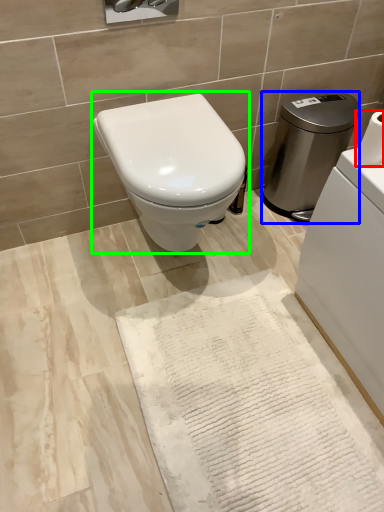
Question: Estimate the real-world distances between objects in this image. Which object is closer to toilet paper (highlighted by a red box), water heater (highlighted by a blue box) or toilet (highlighted by a green box)?

Choices:
 (A) water heater
 (B) toilet

Answer: (B)